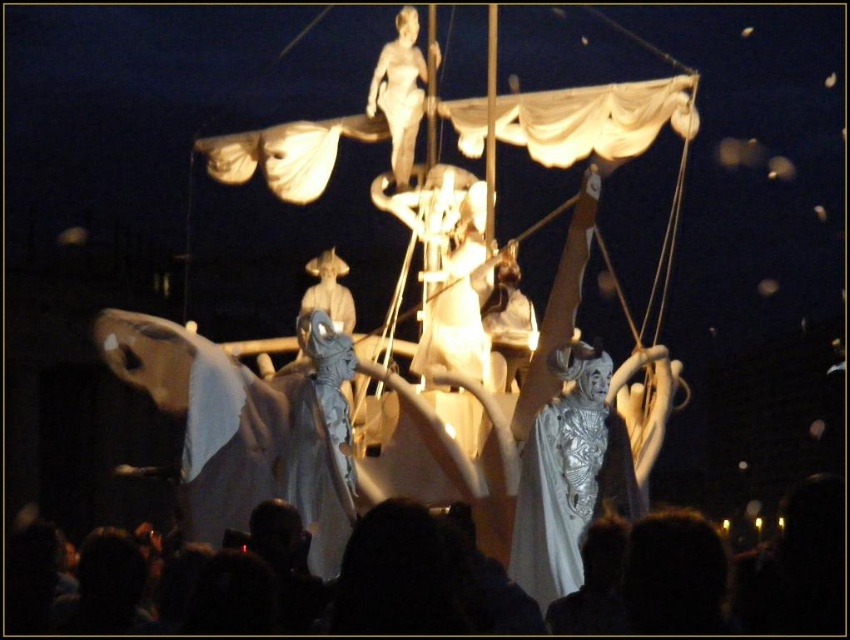
Is point (221, 621) in front of point (162, 321)?

That is True.

Which is more to the right, white fabric figure at center or white fabric horse at center?

white fabric figure at center

What are the coordinates of `white fabric figure at center` in the screenshot? It's located at (737, 572).

Image resolution: width=850 pixels, height=640 pixels. I want to click on white fabric figure at center, so click(737, 572).

Can you confirm if white fabric figure at center is shorter than silver textured statue at center?

Indeed, white fabric figure at center has a lesser height compared to silver textured statue at center.

Can you confirm if white fabric figure at center is positioned below silver textured statue at center?

Correct, white fabric figure at center is located below silver textured statue at center.

Between point (97, 557) and point (564, 500), which one is positioned behind?

The point (564, 500) is behind.

I want to click on white fabric figure at center, so click(737, 572).

Which is in front, point (476, 627) or point (428, 45)?

Point (476, 627)

What do you see at coordinates (737, 572) in the screenshot?
I see `white fabric figure at center` at bounding box center [737, 572].

Does point (131, 627) lie in front of point (411, 115)?

Yes, point (131, 627) is in front of point (411, 115).

This screenshot has height=640, width=850. Find the location of `white fabric figure at center`. white fabric figure at center is located at coordinates 737,572.